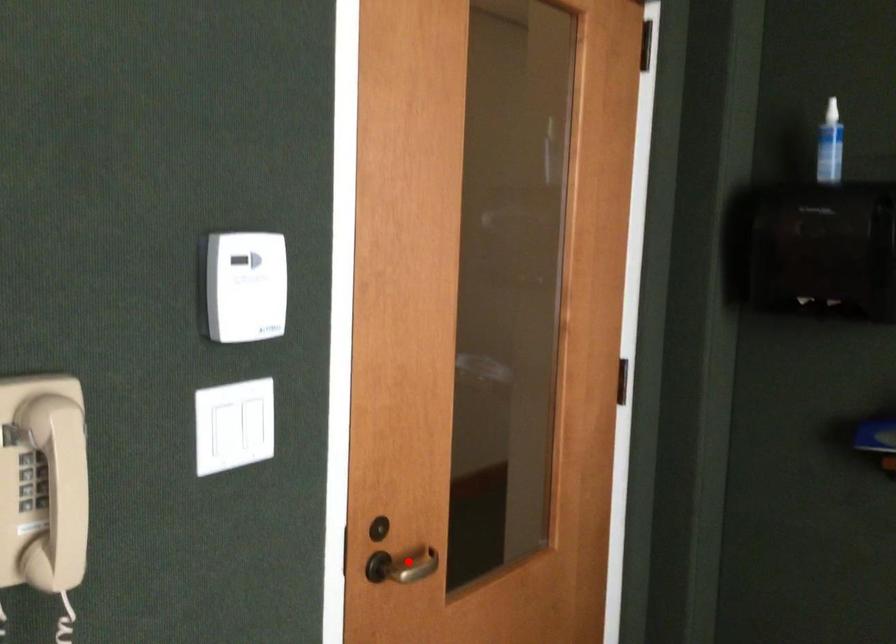
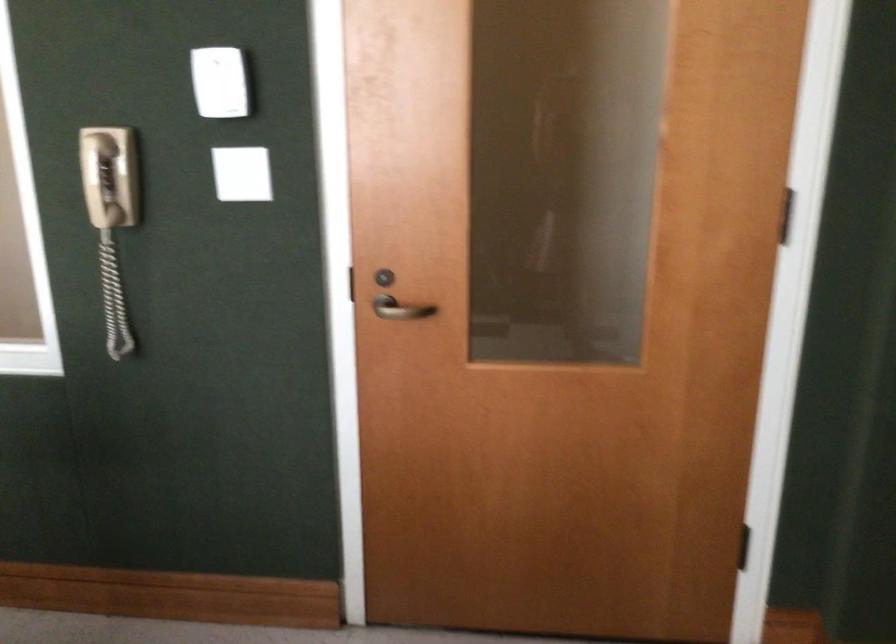
Locate, in the second image, the point that corresponds to the highlighted location in the first image.

(401, 308)